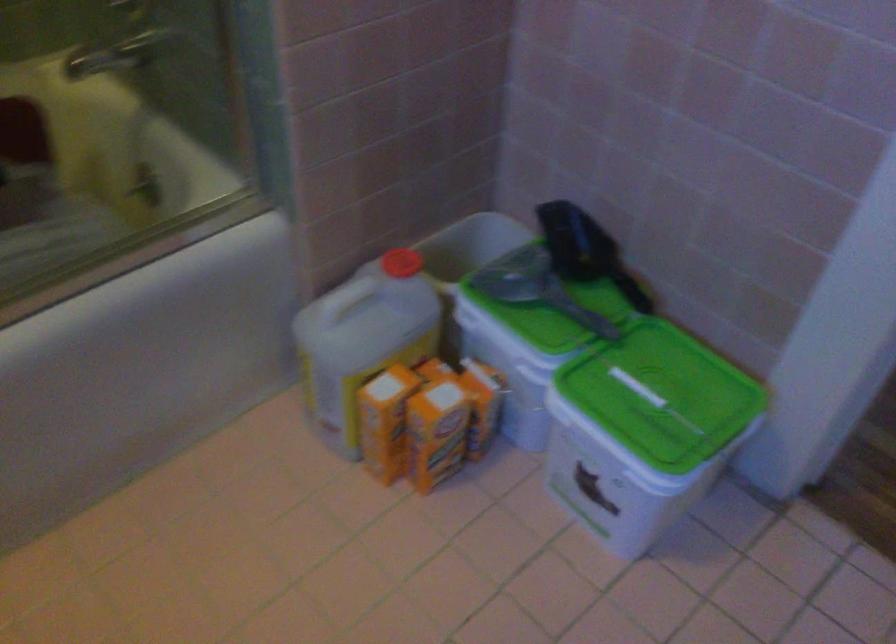
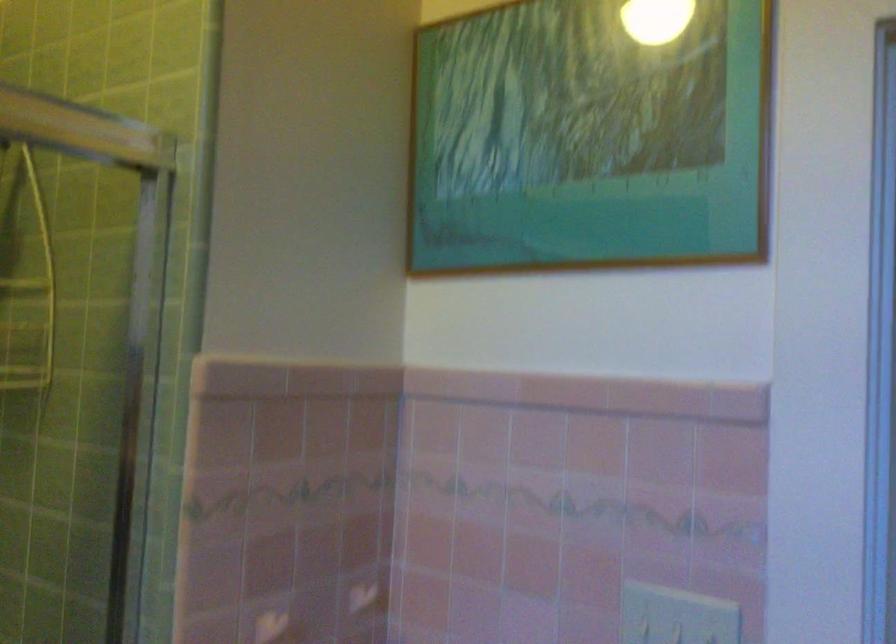
The images are taken continuously from a first-person perspective. In which direction is your viewpoint rotating?

The camera's rotation is toward right-up.